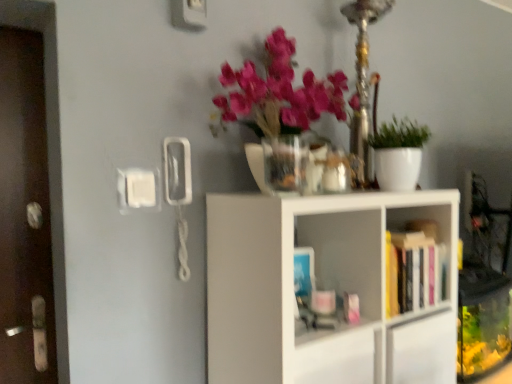
Question: Does translucent glass vase at upper center contain white matte shelf at center, placed as the second shelf when sorted from top to bottom?

Choices:
 (A) no
 (B) yes

Answer: (A)

Question: Is translucent glass vase at upper center facing towards white matte shelf at center, which is the first shelf from bottom to top?

Choices:
 (A) yes
 (B) no

Answer: (B)

Question: Is translucent glass vase at upper center bigger than white matte shelf at center, placed as the second shelf when sorted from top to bottom?

Choices:
 (A) yes
 (B) no

Answer: (B)

Question: From the image's perspective, is translucent glass vase at upper center over white matte shelf at center, which is the first shelf from bottom to top?

Choices:
 (A) yes
 (B) no

Answer: (A)

Question: Can you confirm if translucent glass vase at upper center is positioned to the left of white matte shelf at center, placed as the second shelf when sorted from top to bottom?

Choices:
 (A) no
 (B) yes

Answer: (B)

Question: From the image's perspective, relative to white matte plant pot at right, is hardcover books at center right, which is the first shelf in top-to-bottom order, above or below?

Choices:
 (A) below
 (B) above

Answer: (A)

Question: Is hardcover books at center right, which is the first shelf in top-to-bottom order, in front of or behind white matte plant pot at right in the image?

Choices:
 (A) front
 (B) behind

Answer: (A)

Question: In the image, is hardcover books at center right, which is the first shelf in top-to-bottom order, on the left side or the right side of white matte plant pot at right?

Choices:
 (A) left
 (B) right

Answer: (B)

Question: From a real-world perspective, is hardcover books at center right, which is the first shelf in top-to-bottom order, positioned above or below white matte plant pot at right?

Choices:
 (A) above
 (B) below

Answer: (B)

Question: Is hardcover books at center right, positioned as the second shelf in bottom-to-top order, bigger or smaller than translucent glass vase at upper center?

Choices:
 (A) big
 (B) small

Answer: (A)

Question: Is point (422, 263) closer or farther from the camera than point (270, 157)?

Choices:
 (A) closer
 (B) farther

Answer: (B)

Question: From a real-world perspective, is hardcover books at center right, which is the first shelf in top-to-bottom order, positioned above or below translucent glass vase at upper center?

Choices:
 (A) above
 (B) below

Answer: (B)

Question: From the image's perspective, is hardcover books at center right, which is the first shelf in top-to-bottom order, above or below translucent glass vase at upper center?

Choices:
 (A) below
 (B) above

Answer: (A)

Question: From the image's perspective, is white matte plant pot at right above or below brown wooden door at left?

Choices:
 (A) above
 (B) below

Answer: (A)

Question: Considering the relative positions of white matte plant pot at right and brown wooden door at left in the image provided, is white matte plant pot at right to the left or to the right of brown wooden door at left?

Choices:
 (A) left
 (B) right

Answer: (B)